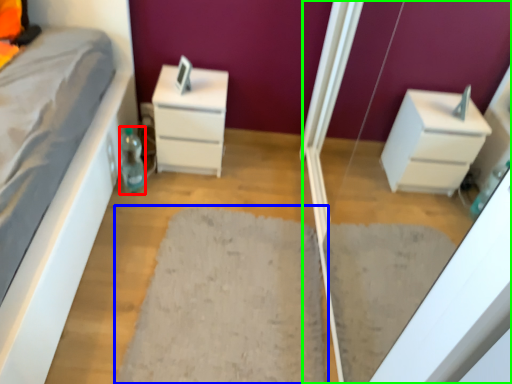
Question: Which is nearer to the bottle (highlighted by a red box)? doormat (highlighted by a blue box) or screen door (highlighted by a green box).

Choices:
 (A) doormat
 (B) screen door

Answer: (A)